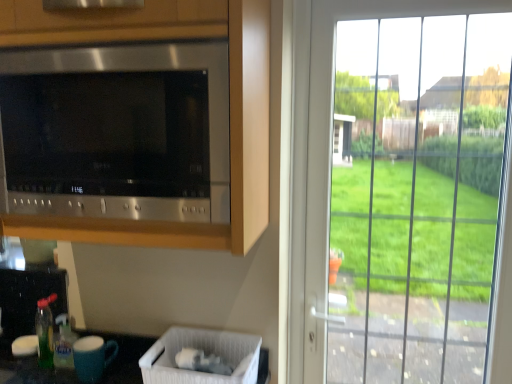
Question: Considering the relative positions of white plastic laundry basket at lower center and blue matte mug at lower left in the image provided, is white plastic laundry basket at lower center in front of blue matte mug at lower left?

Choices:
 (A) yes
 (B) no

Answer: (A)

Question: Does white plastic laundry basket at lower center have a lesser width compared to blue matte mug at lower left?

Choices:
 (A) yes
 (B) no

Answer: (B)

Question: Does white plastic laundry basket at lower center appear on the left side of blue matte mug at lower left?

Choices:
 (A) yes
 (B) no

Answer: (B)

Question: Does white plastic laundry basket at lower center turn towards blue matte mug at lower left?

Choices:
 (A) yes
 (B) no

Answer: (B)

Question: Does white plastic laundry basket at lower center have a lesser height compared to blue matte mug at lower left?

Choices:
 (A) no
 (B) yes

Answer: (B)

Question: Based on their sizes in the image, would you say green translucent bottle at lower left is bigger or smaller than stainless steel microwave at upper left?

Choices:
 (A) small
 (B) big

Answer: (A)

Question: Is green translucent bottle at lower left wider or thinner than stainless steel microwave at upper left?

Choices:
 (A) wide
 (B) thin

Answer: (B)

Question: Which is correct: green translucent bottle at lower left is inside stainless steel microwave at upper left, or outside of it?

Choices:
 (A) outside
 (B) inside

Answer: (A)

Question: Based on their positions, is green translucent bottle at lower left located to the left or right of stainless steel microwave at upper left?

Choices:
 (A) left
 (B) right

Answer: (A)

Question: Does point (59, 352) appear closer or farther from the camera than point (155, 374)?

Choices:
 (A) farther
 (B) closer

Answer: (A)

Question: Is green translucent bottle at lower left in front of or behind white plastic laundry basket at lower center in the image?

Choices:
 (A) front
 (B) behind

Answer: (B)

Question: In terms of height, does green translucent bottle at lower left look taller or shorter compared to white plastic laundry basket at lower center?

Choices:
 (A) short
 (B) tall

Answer: (B)

Question: From a real-world perspective, is green translucent bottle at lower left physically located above or below white plastic laundry basket at lower center?

Choices:
 (A) below
 (B) above

Answer: (B)

Question: Relative to green translucent bottle at lower left, is white plastic laundry basket at lower center in front or behind?

Choices:
 (A) behind
 (B) front

Answer: (B)

Question: In terms of width, does white plastic laundry basket at lower center look wider or thinner when compared to green translucent bottle at lower left?

Choices:
 (A) wide
 (B) thin

Answer: (A)